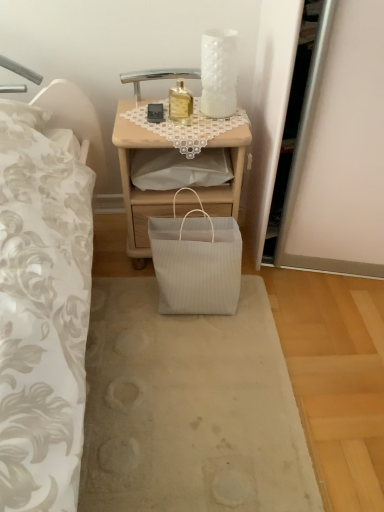
Question: Can you confirm if woodennightstand at center is shorter than gold glass bottle at upper center?

Choices:
 (A) yes
 (B) no

Answer: (B)

Question: Is woodennightstand at center facing away from gold glass bottle at upper center?

Choices:
 (A) yes
 (B) no

Answer: (B)

Question: Does woodennightstand at center have a smaller size compared to gold glass bottle at upper center?

Choices:
 (A) yes
 (B) no

Answer: (B)

Question: Would you say gold glass bottle at upper center is part of woodennightstand at center's contents?

Choices:
 (A) no
 (B) yes

Answer: (A)

Question: Is woodennightstand at center closer to the viewer compared to gold glass bottle at upper center?

Choices:
 (A) yes
 (B) no

Answer: (B)

Question: From the image's perspective, is woodennightstand at center below gold glass bottle at upper center?

Choices:
 (A) no
 (B) yes

Answer: (B)

Question: Can you confirm if gold glass bottle at upper center is shorter than white ribbed paper bag at center?

Choices:
 (A) yes
 (B) no

Answer: (B)

Question: Does gold glass bottle at upper center come in front of white ribbed paper bag at center?

Choices:
 (A) yes
 (B) no

Answer: (B)

Question: Is gold glass bottle at upper center smaller than white ribbed paper bag at center?

Choices:
 (A) no
 (B) yes

Answer: (B)

Question: Can you confirm if gold glass bottle at upper center is wider than white ribbed paper bag at center?

Choices:
 (A) no
 (B) yes

Answer: (A)

Question: Can you confirm if gold glass bottle at upper center is thinner than white ribbed paper bag at center?

Choices:
 (A) no
 (B) yes

Answer: (B)

Question: Can you confirm if gold glass bottle at upper center is positioned to the left of white ribbed paper bag at center?

Choices:
 (A) yes
 (B) no

Answer: (B)

Question: Is white ribbed paper bag at center shorter than gold glass bottle at upper center?

Choices:
 (A) no
 (B) yes

Answer: (B)